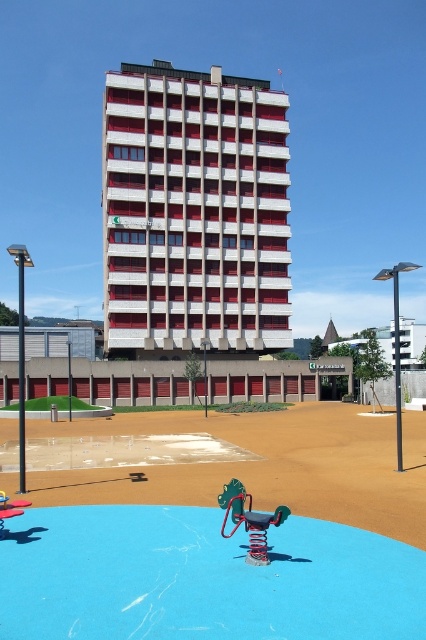
Question: Which point appears closest to the camera in this image?

Choices:
 (A) (23, 513)
 (B) (258, 184)

Answer: (A)

Question: Based on their relative distances, which object is nearer to the metallic spring at center?

Choices:
 (A) metallic blue swing at center
 (B) white concrete building at center

Answer: (A)

Question: Which of the following is the closest to the observer?

Choices:
 (A) (224, 534)
 (B) (112, 253)
 (C) (2, 493)

Answer: (A)

Question: Is metallic spring at center below metallic blue swing at center?

Choices:
 (A) yes
 (B) no

Answer: (B)

Question: Does white concrete building at center appear on the right side of metallic spring at center?

Choices:
 (A) yes
 (B) no

Answer: (B)

Question: Can you confirm if white concrete building at center is wider than metallic spring at center?

Choices:
 (A) yes
 (B) no

Answer: (A)